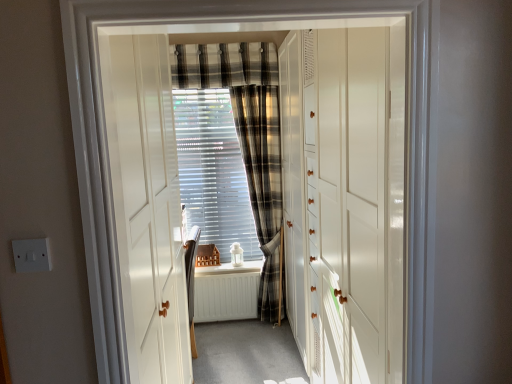
The image size is (512, 384). Find the location of `vacant space situated above plaid fabric curtain at upper center, which is the second curtain in bottom-to-top order (from a real-world perspective)`. vacant space situated above plaid fabric curtain at upper center, which is the second curtain in bottom-to-top order (from a real-world perspective) is located at coordinates (227, 52).